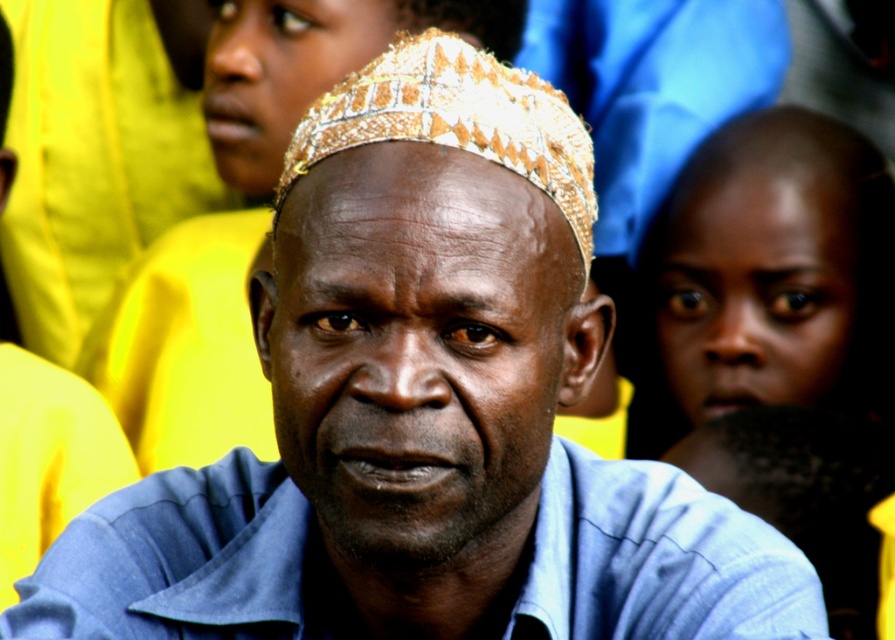
Question: Which object appears farthest from the camera in this image?

Choices:
 (A) matte gold headwear at center
 (B) blue fabric head at lower right
 (C) smooth skin head at right
 (D) beaded fabric headscarf at center

Answer: (C)

Question: Considering the relative positions of smooth skin head at right and blue fabric head at lower right in the image provided, where is smooth skin head at right located with respect to blue fabric head at lower right?

Choices:
 (A) below
 (B) above

Answer: (B)

Question: Among these objects, which one is nearest to the camera?

Choices:
 (A) blue fabric head at lower right
 (B) beaded fabric headscarf at center
 (C) matte gold headwear at center
 (D) golden woven hat at center

Answer: (C)

Question: Which point appears closest to the camera in this image?

Choices:
 (A) (848, 628)
 (B) (757, 396)
 (C) (430, 120)
 (D) (377, 522)

Answer: (D)

Question: Is golden woven hat at center positioned in front of blue fabric head at lower right?

Choices:
 (A) no
 (B) yes

Answer: (A)

Question: Where is golden woven hat at center located in relation to blue fabric head at lower right in the image?

Choices:
 (A) left
 (B) right

Answer: (A)